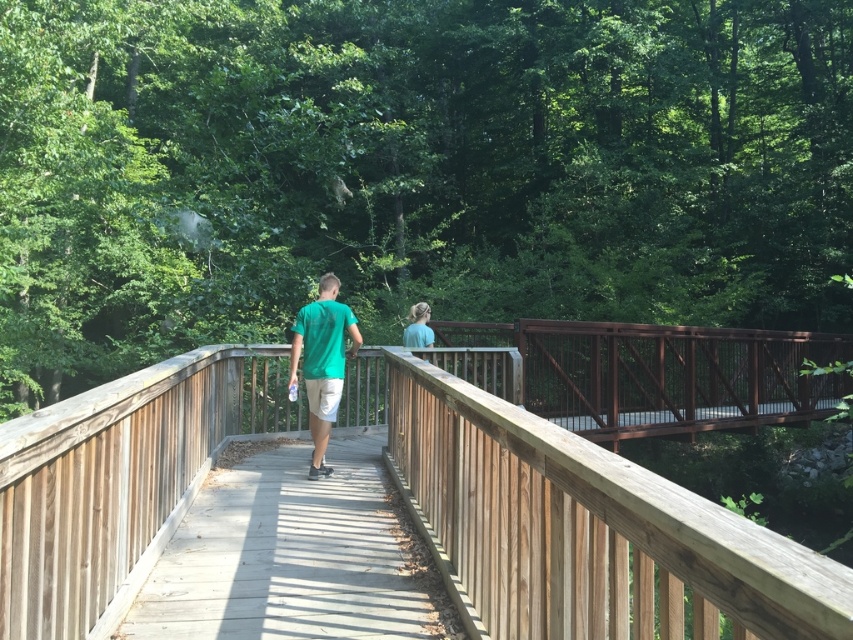
Question: Which object is positioned closest to the wooden walkway at center?

Choices:
 (A) wooden railing at center
 (B) green matte shirt at center
 (C) light blue shirt at center
 (D) stained wood bridge at center

Answer: (B)

Question: Does wooden railing at center appear under stained wood bridge at center?

Choices:
 (A) yes
 (B) no

Answer: (B)

Question: Is wooden railing at center bigger than green matte shirt at center?

Choices:
 (A) yes
 (B) no

Answer: (B)

Question: Which object appears closest to the camera in this image?

Choices:
 (A) stained wood bridge at center
 (B) light blue shirt at center

Answer: (B)

Question: Estimate the real-world distances between objects in this image. Which object is farther from the stained wood bridge at center?

Choices:
 (A) wooden railing at center
 (B) green matte shirt at center
 (C) wooden walkway at center
 (D) light blue shirt at center

Answer: (C)

Question: Can you confirm if wooden railing at center is positioned to the right of light blue shirt at center?

Choices:
 (A) yes
 (B) no

Answer: (B)